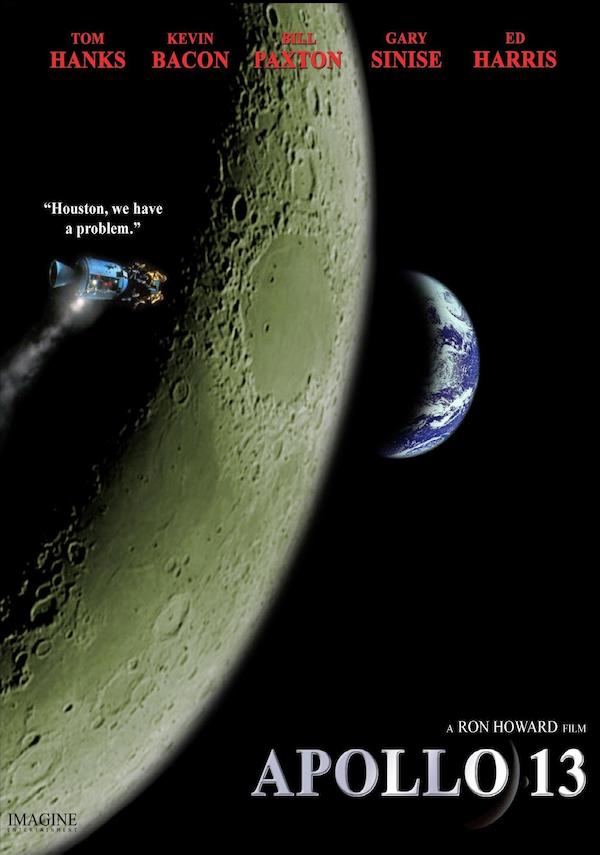
Identify the location of movie poster. The image size is (600, 855). (404, 645).